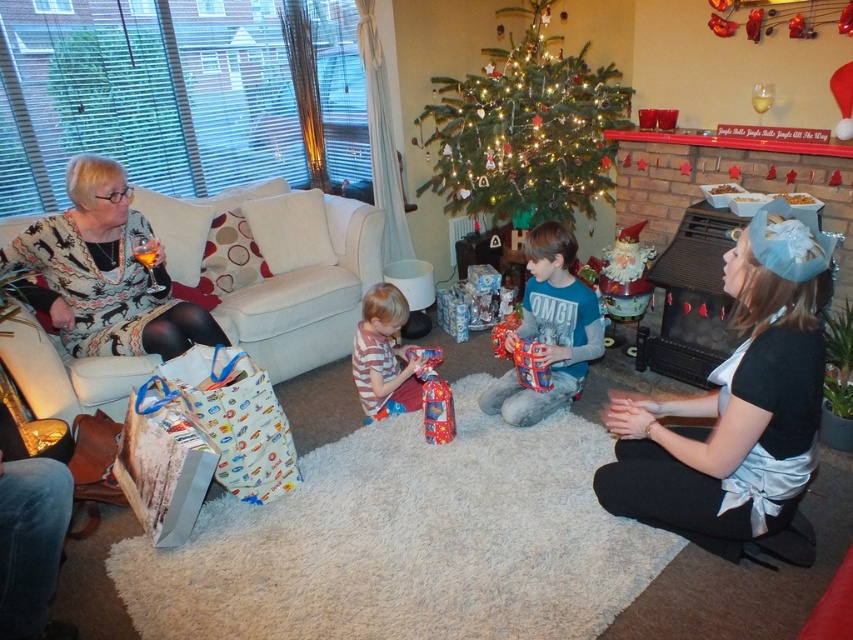
Which is in front, point (62, 244) or point (381, 381)?

Point (62, 244)

Does point (67, 182) come in front of point (386, 385)?

Yes.

Locate an element on the screen. The image size is (853, 640). patterned sweater at left is located at coordinates (105, 273).

Which is more to the left, patterned sweater at left or blue cotton shirt at center?

Positioned to the left is patterned sweater at left.

Who is more distant from viewer, (55,228) or (534,253)?

Positioned behind is point (534,253).

I want to click on patterned sweater at left, so click(x=105, y=273).

Does silky silver dress at lower right lie in front of green matte christmas tree at center?

Yes, silky silver dress at lower right is closer to the viewer.

Can you confirm if silky silver dress at lower right is taller than green matte christmas tree at center?

No, silky silver dress at lower right is not taller than green matte christmas tree at center.

You are a GUI agent. You are given a task and a screenshot of the screen. Output one action in this format:
    pyautogui.click(x=<x>, y=<y>)
    Task: Click on the silky silver dress at lower right
    
    Given the screenshot: What is the action you would take?
    pyautogui.click(x=730, y=408)